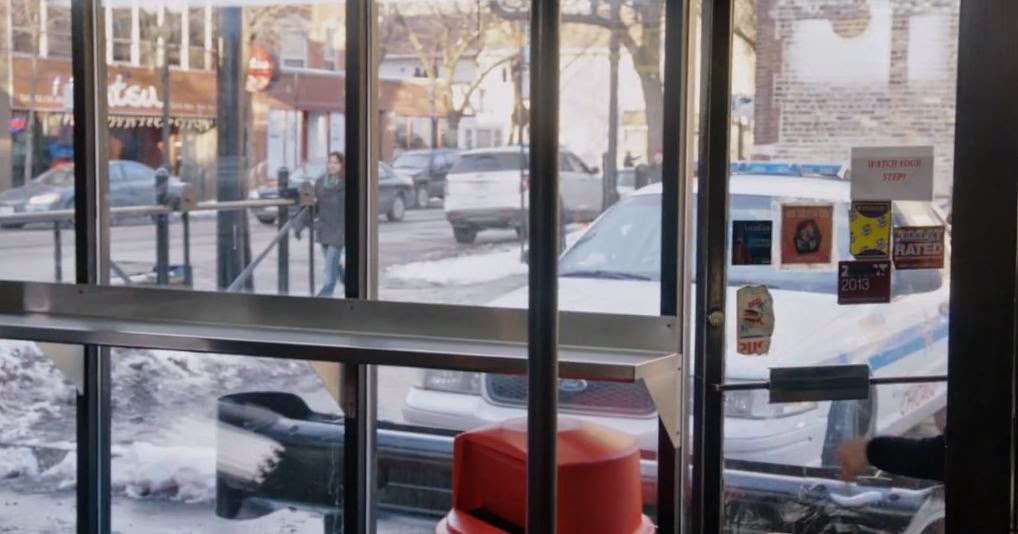
Where is `trash can lid`? This screenshot has width=1018, height=534. trash can lid is located at coordinates (580, 504).